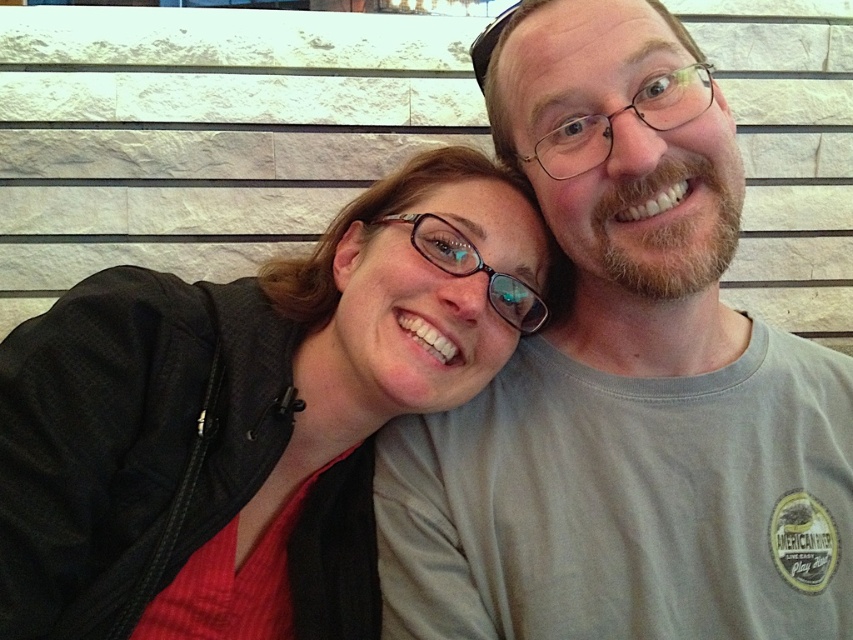
Is matte black jacket at upper left thinner than transparent plastic glasses at center?

No.

Which is in front, point (276, 422) or point (532, 291)?

Point (532, 291) is in front.

Which is in front, point (387, 326) or point (502, 300)?

Point (387, 326) is more forward.

Find the location of a particular element. The height and width of the screenshot is (640, 853). matte black jacket at upper left is located at coordinates 250,416.

Is gray cotton t-shirt at center taller than matte black jacket at upper left?

Yes.

What do you see at coordinates (625, 381) in the screenshot? I see `gray cotton t-shirt at center` at bounding box center [625, 381].

The width and height of the screenshot is (853, 640). Identify the location of gray cotton t-shirt at center. (625, 381).

Can you confirm if gray cotton t-shirt at center is bigger than transparent plastic glasses at center?

Indeed, gray cotton t-shirt at center has a larger size compared to transparent plastic glasses at center.

Who is shorter, gray cotton t-shirt at center or transparent plastic glasses at center?

Standing shorter between the two is transparent plastic glasses at center.

Is point (705, 148) positioned after point (448, 240)?

That is False.

Where is `gray cotton t-shirt at center`? The image size is (853, 640). gray cotton t-shirt at center is located at coordinates (625, 381).